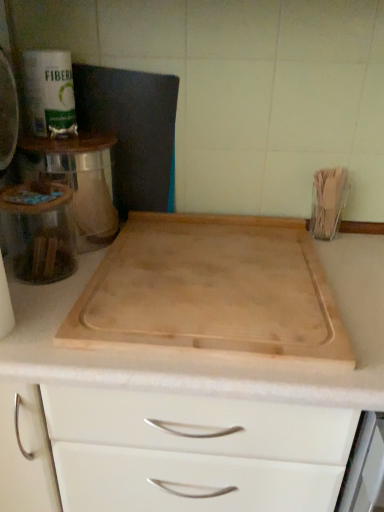
Where is `free spot behind clear glass jar at left, the second appliance positioned from the top`? free spot behind clear glass jar at left, the second appliance positioned from the top is located at coordinates (80, 251).